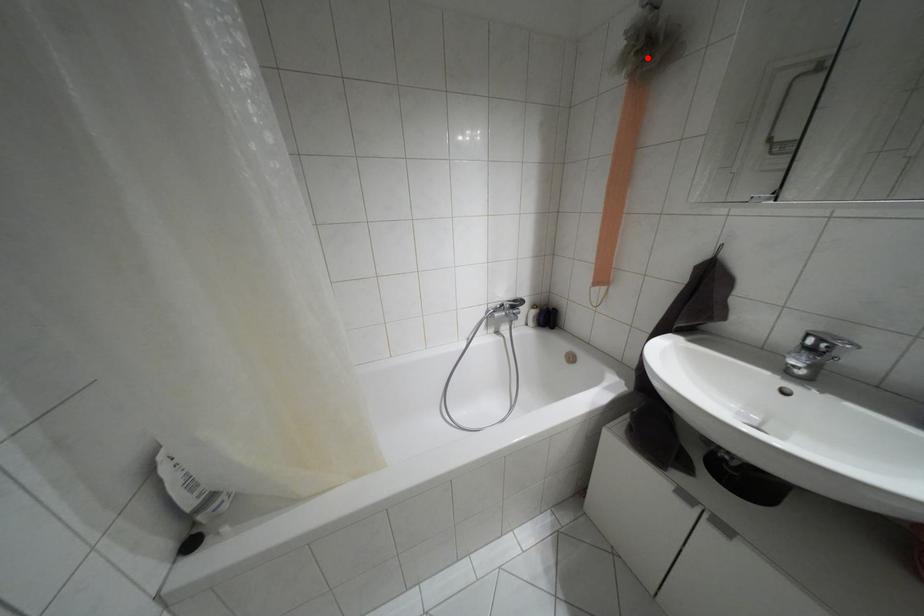
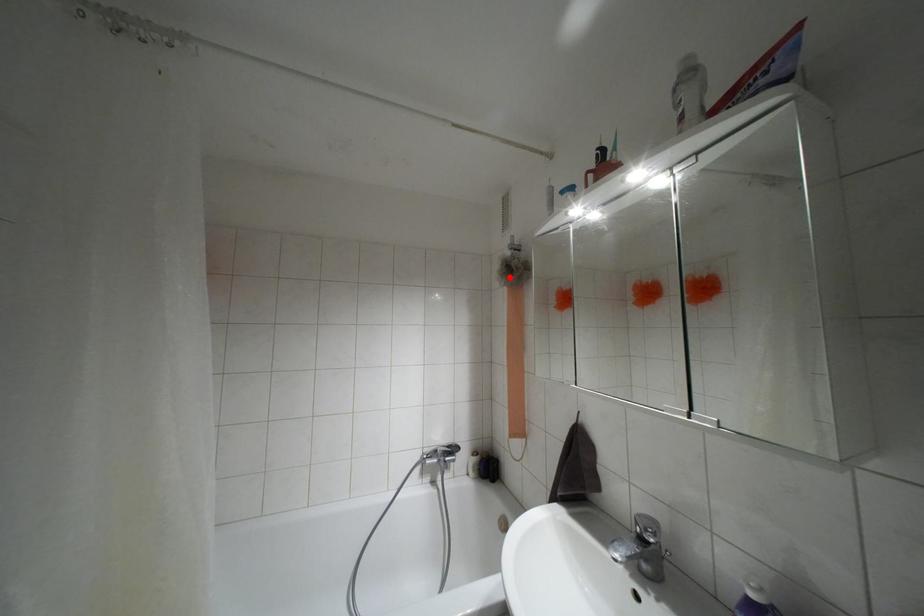
I am providing you with two images of the same scene from different viewpoints. A red point is marked on the first image and another point is marked on the second image. Are the points marked in image1 and image2 representing the same 3D position?

Yes